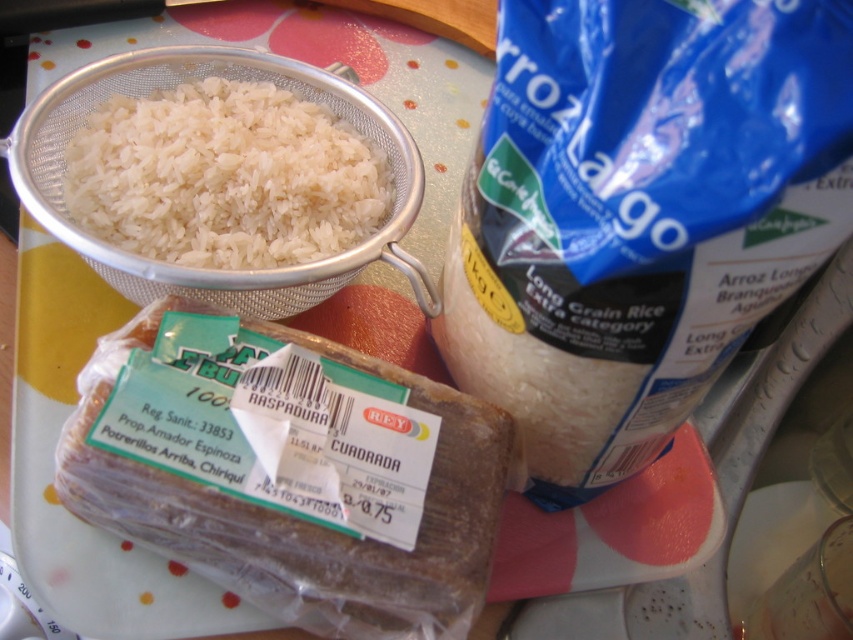
Which is behind, point (473, 586) or point (129, 140)?

Point (129, 140)

Can you confirm if brown bread at center is positioned below white matte rice at upper left?

Yes.

Does point (387, 564) come closer to viewer compared to point (351, 225)?

That is True.

What are the coordinates of `brown bread at center` in the screenshot? It's located at (300, 518).